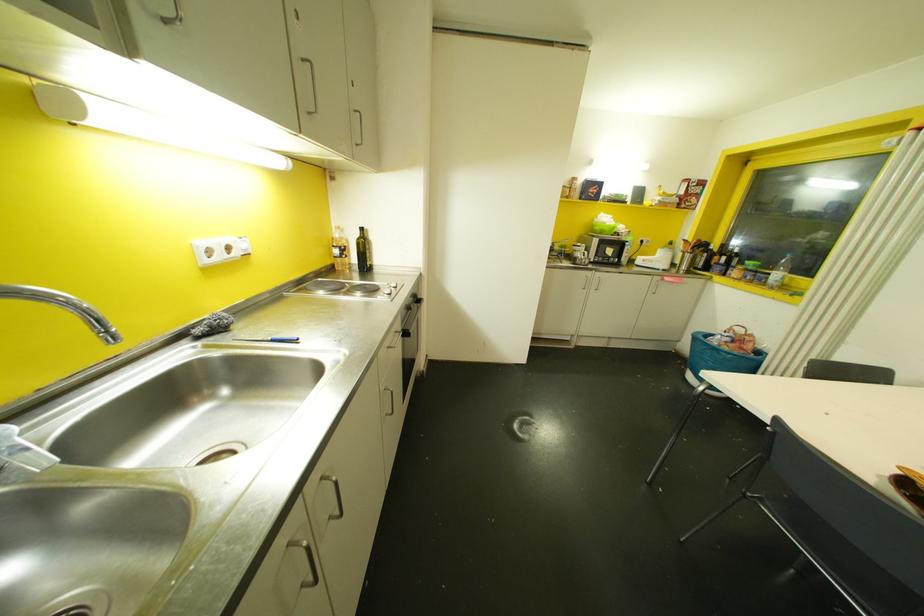
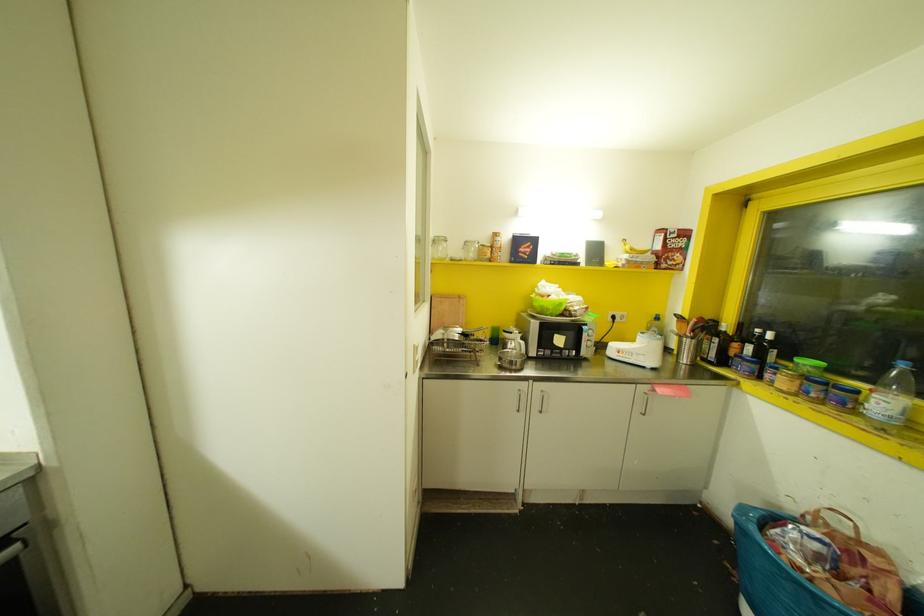
The point at (706, 267) is marked in the first image. Where is the corresponding point in the second image?

(723, 361)